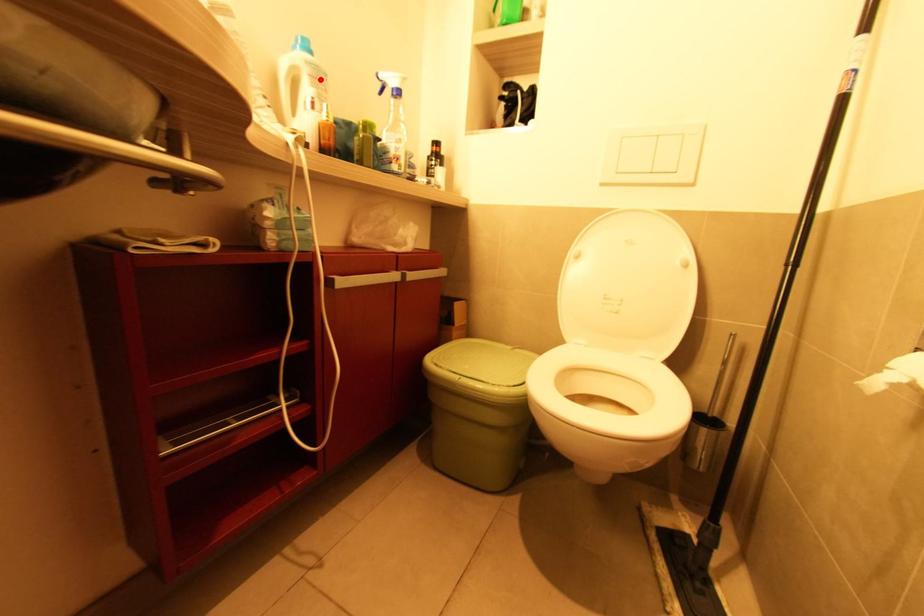
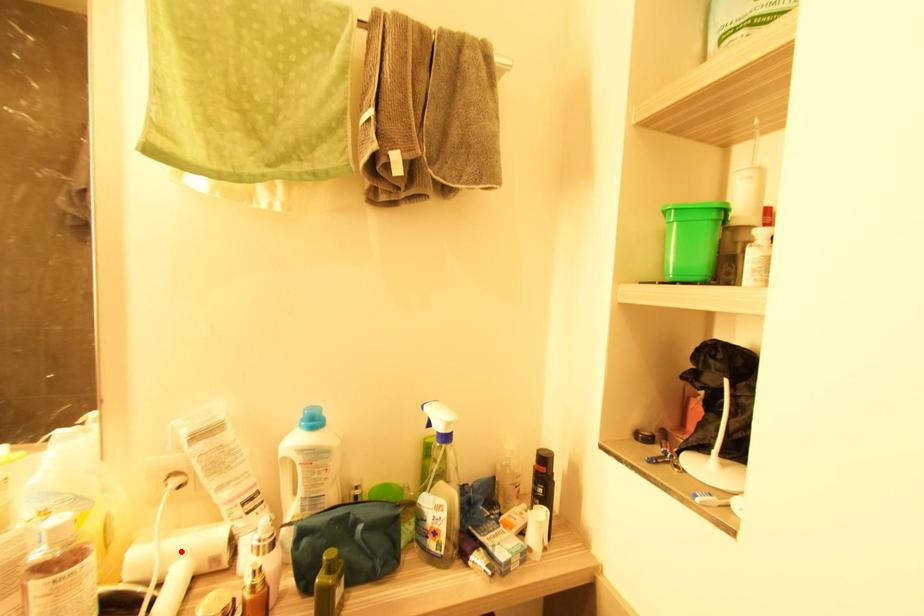
I am providing you with two images of the same scene from different viewpoints. A red point is marked on the first image and another point is marked on the second image. Is the marked point in image1 the same physical position as the marked point in image2?

No